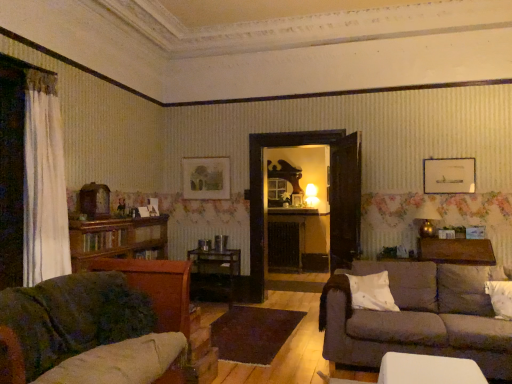
The image size is (512, 384). In order to click on free region on the left part of dark brown fabric couch at lower right, which ranks as the second studio couch in front-to-back order in this screenshot , I will do `click(284, 350)`.